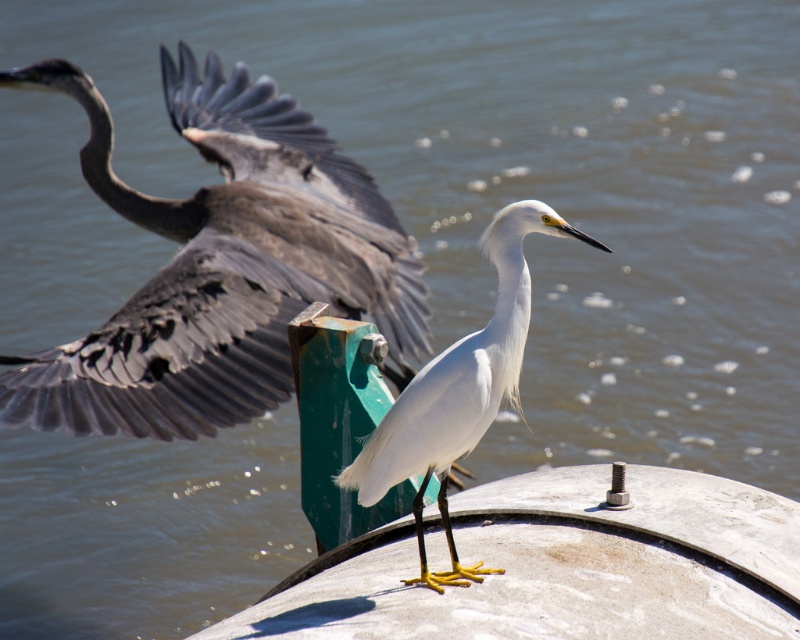
Is gray matte heron at left wider than white matte bird at center?

Correct, the width of gray matte heron at left exceeds that of white matte bird at center.

Which is behind, point (388, 326) or point (462, 362)?

Point (388, 326)

This screenshot has height=640, width=800. I want to click on gray matte heron at left, so click(220, 264).